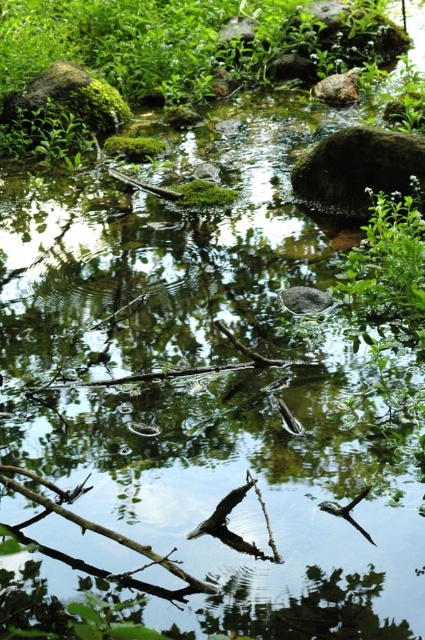
Who is higher up, green leafy plant at upper right or green mossy rock at upper left?

green mossy rock at upper left is above.

Is point (399, 204) farther from viewer compared to point (96, 81)?

No, it is not.

The width and height of the screenshot is (425, 640). In order to click on green leafy plant at upper right in this screenshot , I will do `click(387, 260)`.

Does green mossy rock at upper right appear under green mossy rock at upper left?

Indeed, green mossy rock at upper right is positioned under green mossy rock at upper left.

Which is above, green mossy rock at upper right or green mossy rock at upper left?

green mossy rock at upper left is above.

You are a GUI agent. You are given a task and a screenshot of the screen. Output one action in this format:
    pyautogui.click(x=<x>, y=<y>)
    Task: Click on the green mossy rock at upper right
    This screenshot has width=425, height=640.
    Given the screenshot: What is the action you would take?
    pyautogui.click(x=359, y=170)

At what (x,y) coordinates should I click in order to perform the action: click on green mossy rock at upper right. Please return your answer as a coordinate pair (x, y). The height and width of the screenshot is (640, 425). Looking at the image, I should click on (359, 170).

Does green leafy plant at upper right have a smaller size compared to green mossy rock at upper right?

Incorrect, green leafy plant at upper right is not smaller in size than green mossy rock at upper right.

Can you confirm if green leafy plant at upper right is wider than green mossy rock at upper right?

No, green leafy plant at upper right is not wider than green mossy rock at upper right.

Who is more distant from viewer, (376, 236) or (354, 154)?

Positioned behind is point (354, 154).

Where is `green leafy plant at upper right`? This screenshot has height=640, width=425. green leafy plant at upper right is located at coordinates (387, 260).